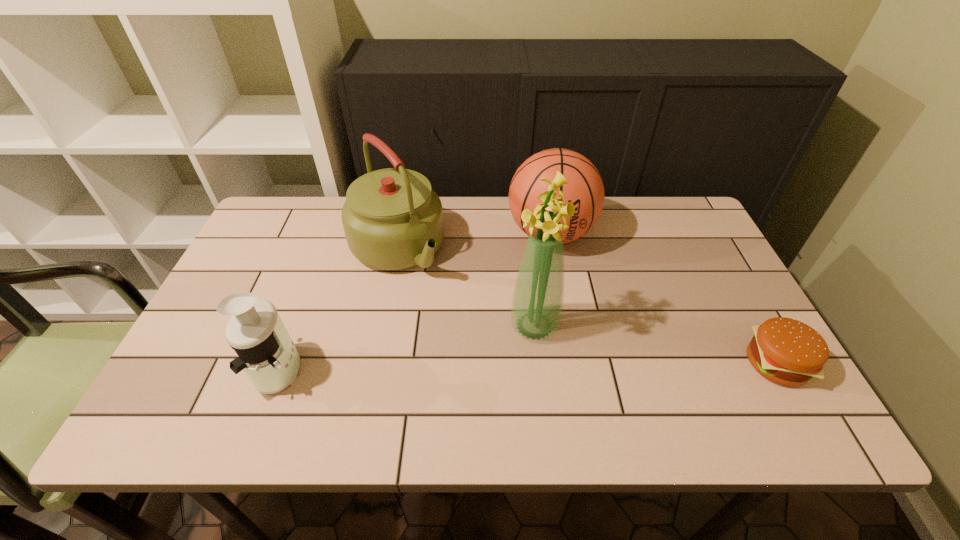
At what (x,y) coordinates should I click in order to perform the action: click on the leftmost object. Please return your answer as a coordinate pair (x, y). The image size is (960, 540). Looking at the image, I should click on (266, 352).

Where is `hamburger`? The image size is (960, 540). hamburger is located at coordinates (786, 351).

Where is `the rightmost object`? the rightmost object is located at coordinates 786,351.

I want to click on basketball, so click(x=585, y=189).

This screenshot has width=960, height=540. In order to click on the tallest object in this screenshot , I will do `click(537, 302)`.

At what (x,y) coordinates should I click in order to perform the action: click on the fourth shortest object. Please return your answer as a coordinate pair (x, y). The width and height of the screenshot is (960, 540). Looking at the image, I should click on (392, 218).

You are a GUI agent. You are given a task and a screenshot of the screen. Output one action in this format:
    pyautogui.click(x=<x>, y=<y>)
    Task: Click on the fourth object from right to left
    This screenshot has width=960, height=540.
    Given the screenshot: What is the action you would take?
    pyautogui.click(x=392, y=218)

Locate an element on the screen. The width and height of the screenshot is (960, 540). blank space located 0.210m on the back of the juicer is located at coordinates (314, 278).

I want to click on vacant space located 0.390m on the left of the rightmost object, so click(x=573, y=363).

The image size is (960, 540). What are the coordinates of `vacant space located on the surface of the basketball near the brand logo` in the screenshot? It's located at (555, 321).